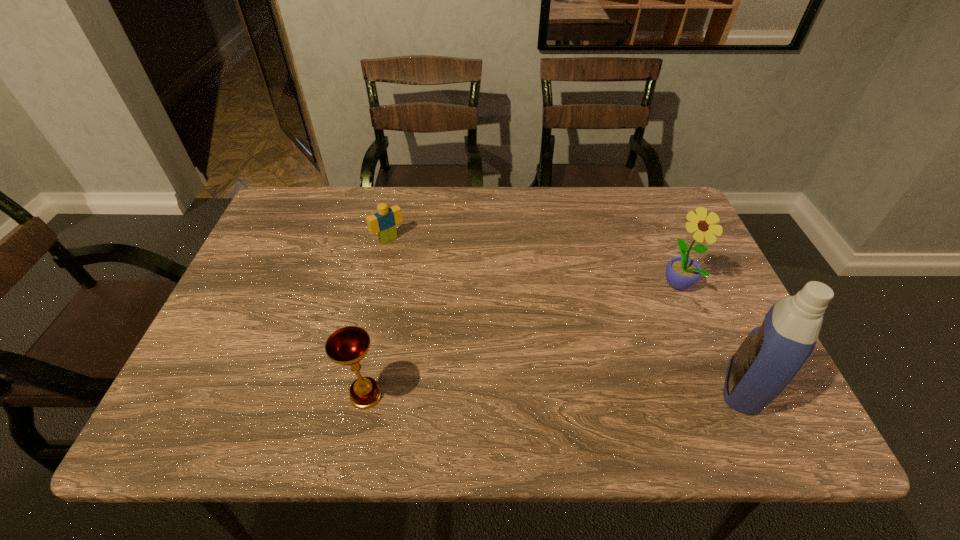
The height and width of the screenshot is (540, 960). I want to click on free space between the tallest object and the sunflower, so click(710, 335).

Identify the location of vacant space that's between the detergent and the shortest object. This screenshot has width=960, height=540. (566, 313).

At what (x,y) coordinates should I click in order to perform the action: click on free space between the farthest object and the chalice. Please return your answer as a coordinate pair (x, y). Looking at the image, I should click on (377, 318).

Locate an element on the screen. Image resolution: width=960 pixels, height=540 pixels. free space between the tallest object and the farthest object is located at coordinates (566, 313).

Where is `vacant point located between the tallest object and the farthest object`? The width and height of the screenshot is (960, 540). vacant point located between the tallest object and the farthest object is located at coordinates (566, 313).

Find the location of `free spot between the shortest object and the sunflower`. free spot between the shortest object and the sunflower is located at coordinates (533, 261).

Where is `empty space between the third tallest object and the tallest object`? empty space between the third tallest object and the tallest object is located at coordinates (555, 391).

Identify which object is the second closest to the chalice. Please provide its 2D coordinates. Your answer should be formatted as a tuple, i.e. [(x, y)], where the tuple contains the x and y coordinates of a point satisfying the conditions above.

[(772, 354)]

Identify the location of object that is the nearest to the chalice. The height and width of the screenshot is (540, 960). (384, 222).

Where is `vacant position in the image that satisfies the following two spatial constraints: 1. on the front side of the second farthest object; 2. on the left side of the tallest object`? Image resolution: width=960 pixels, height=540 pixels. vacant position in the image that satisfies the following two spatial constraints: 1. on the front side of the second farthest object; 2. on the left side of the tallest object is located at coordinates (721, 387).